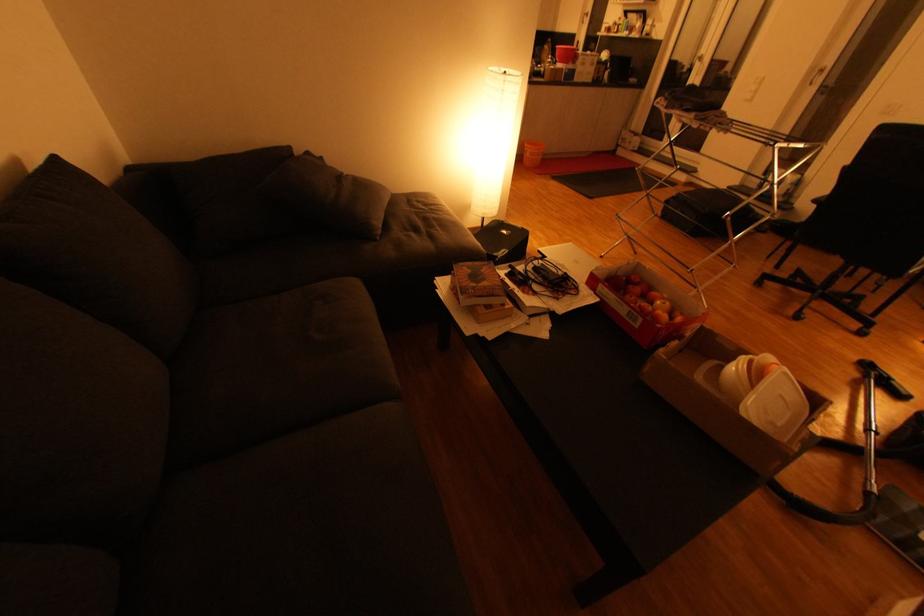
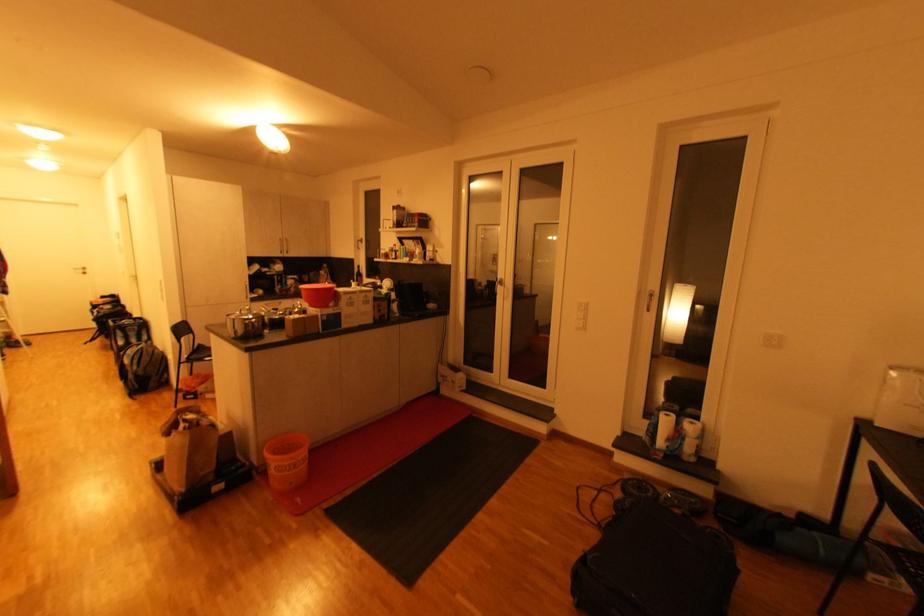
Locate, in the second image, the point that corresponds to point (565, 63) in the first image.

(315, 307)